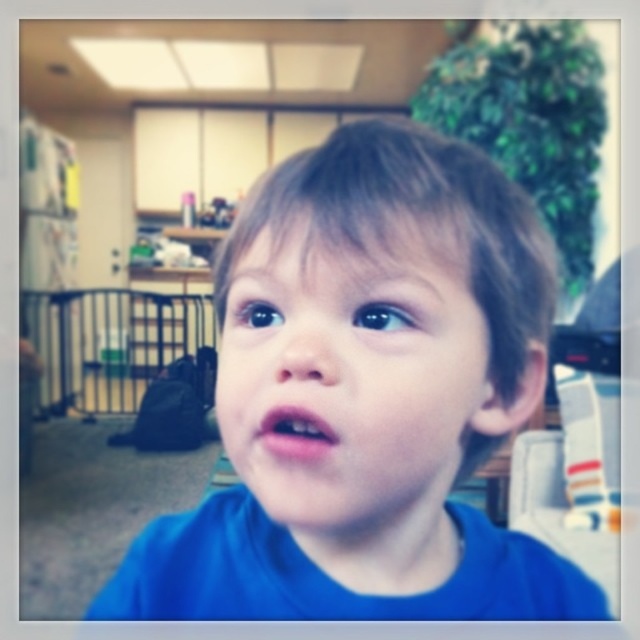
Who is taller, blue matte shirt at center or pink matte lips at center?

With more height is blue matte shirt at center.

Is point (188, 532) closer to viewer compared to point (317, 416)?

No, (188, 532) is further to viewer.

Identify the location of blue matte shirt at center. (369, 396).

Where is `blue matte shirt at center`? The height and width of the screenshot is (640, 640). blue matte shirt at center is located at coordinates (369, 396).

Which is more to the right, blue matte shirt at center or blue matte face at center?

blue matte shirt at center is more to the right.

Based on the photo, is blue matte shirt at center above blue matte face at center?

No, blue matte shirt at center is not above blue matte face at center.

You are a GUI agent. You are given a task and a screenshot of the screen. Output one action in this format:
    pyautogui.click(x=<x>, y=<y>)
    Task: Click on the blue matte shirt at center
    
    Given the screenshot: What is the action you would take?
    pyautogui.click(x=369, y=396)

Can you confirm if blue matte face at center is taller than pink matte lips at center?

Yes, blue matte face at center is taller than pink matte lips at center.

Describe the element at coordinates (348, 378) in the screenshot. I see `blue matte face at center` at that location.

Image resolution: width=640 pixels, height=640 pixels. In order to click on blue matte face at center in this screenshot , I will do `click(348, 378)`.